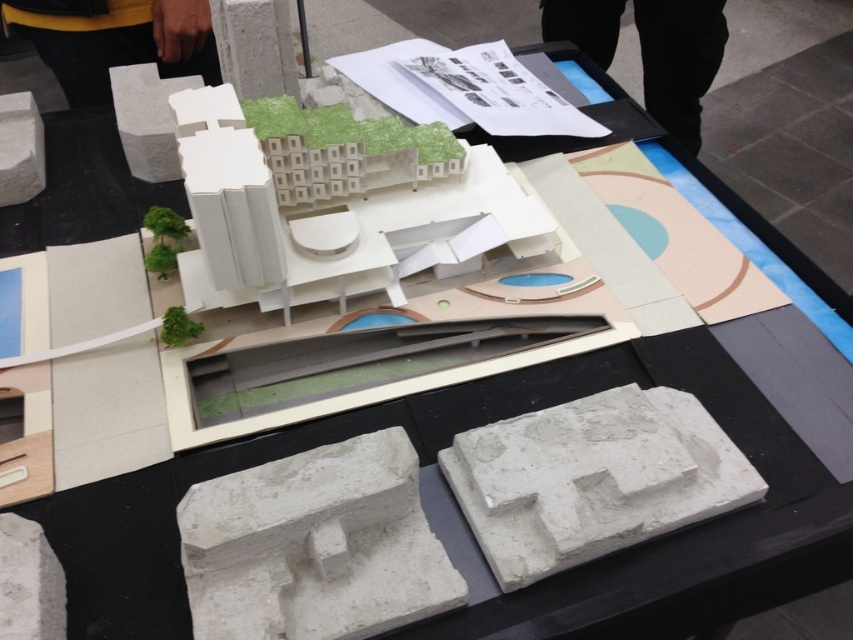
Question: Which is farther from the yellow fabric at upper left?

Choices:
 (A) white concrete block at center
 (B) white concrete block at lower left
 (C) white concrete block at upper left
 (D) white concrete block at lower center

Answer: (A)

Question: Estimate the real-world distances between objects in this image. Which object is closer to the white concrete block at lower left?

Choices:
 (A) white matte stone at upper left
 (B) yellow fabric at upper left
 (C) white concrete block at lower center
 (D) black pants at upper center

Answer: (C)

Question: Which of these objects is positioned closest to the white matte stone at upper left?

Choices:
 (A) white concrete block at upper left
 (B) white concrete block at lower left
 (C) yellow fabric at upper left

Answer: (A)

Question: From the image, what is the correct spatial relationship of white concrete block at center in relation to yellow fabric at upper left?

Choices:
 (A) above
 (B) below

Answer: (B)

Question: Can you confirm if yellow fabric at upper left is positioned to the right of black pants at upper center?

Choices:
 (A) yes
 (B) no

Answer: (B)

Question: Is yellow fabric at upper left smaller than black pants at upper center?

Choices:
 (A) no
 (B) yes

Answer: (B)